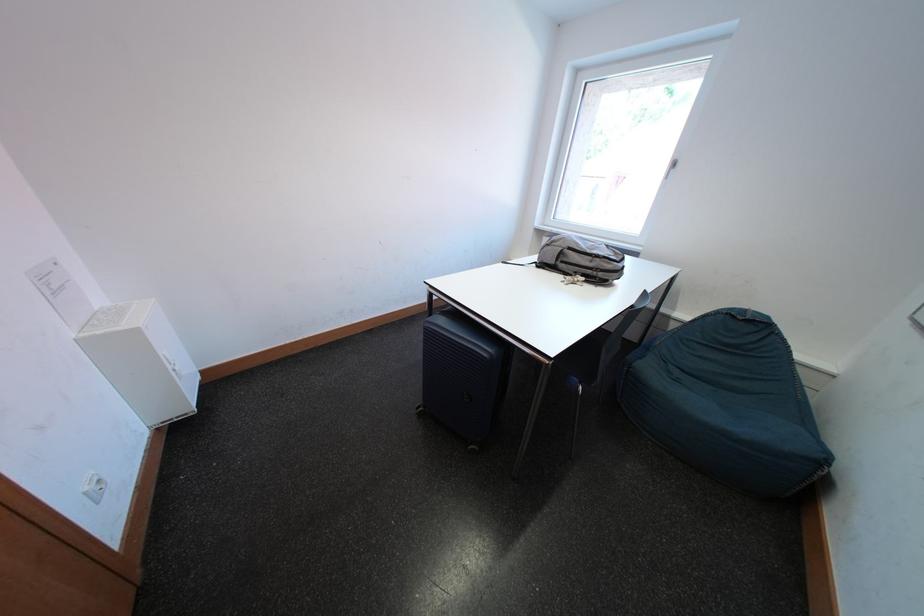
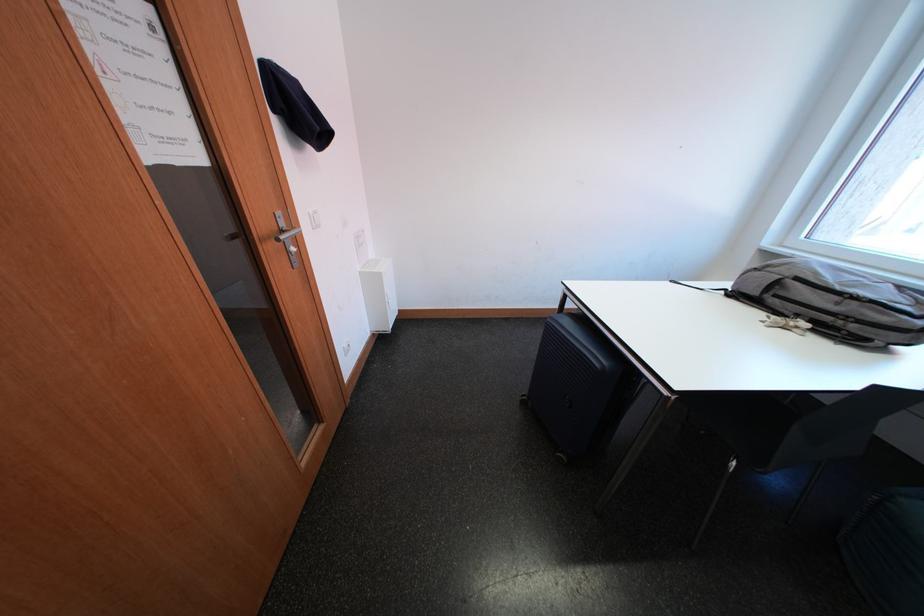
Question: The images are taken continuously from a first-person perspective. In which direction is your viewpoint rotating?

Choices:
 (A) Left
 (B) Right
 (C) Up
 (D) Down

Answer: (A)